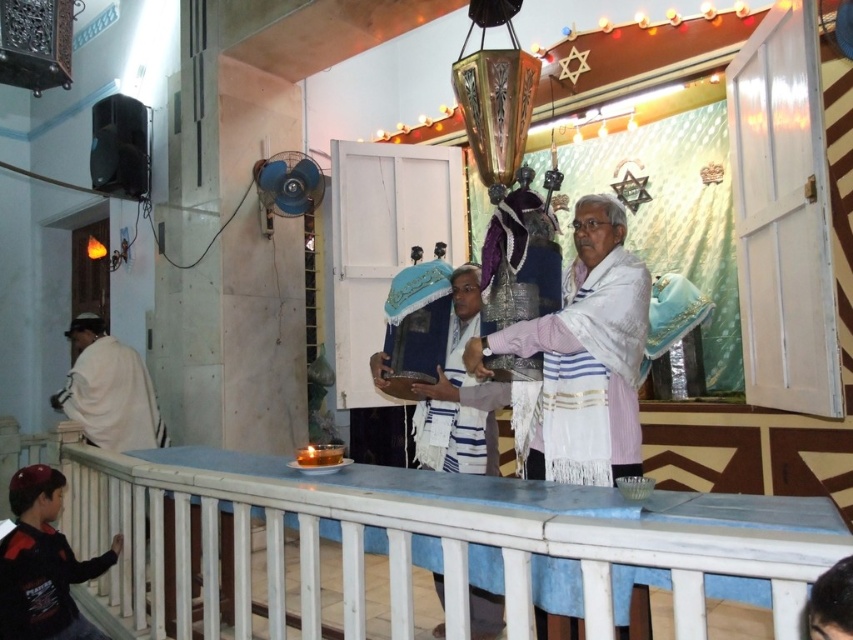
Question: Which of these objects is positioned farthest from the dark blue fabric robe at lower left?

Choices:
 (A) white textured shawl at center
 (B) white cloth at left
 (C) white painted wood at lower center
 (D) white textured robe at center

Answer: (A)

Question: Can you confirm if white painted wood at lower center is positioned to the right of white textured shawl at center?

Choices:
 (A) no
 (B) yes

Answer: (A)

Question: Among these objects, which one is farthest from the camera?

Choices:
 (A) dark blue fabric robe at lower left
 (B) white textured shawl at center

Answer: (A)

Question: Which point is closer to the camera?

Choices:
 (A) white painted wood at lower center
 (B) white cloth at left

Answer: (A)

Question: Does white painted wood at lower center appear on the left side of dark blue fabric robe at lower left?

Choices:
 (A) no
 (B) yes

Answer: (A)

Question: Is white textured robe at center wider than white cloth at left?

Choices:
 (A) yes
 (B) no

Answer: (B)